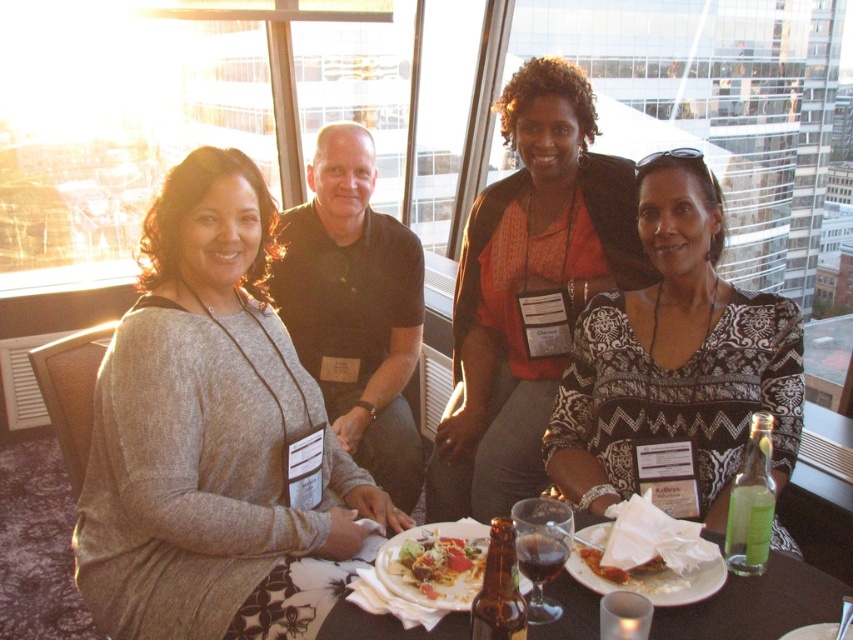
You are a waiter at the high rise restaurant. You need to deliver a drink to the person wearing the matte gray sweater at left. The drink is currently on the table at the center where the crunchy tortilla chips at center are placed. Can you directly hand the drink to the person without moving any items on the table?

The crunchy tortilla chips at center is behind the matte gray sweater at left, so the drink on the table at the center where the crunchy tortilla chips at center are placed is behind the person. Therefore, you cannot directly hand the drink to the person wearing the matte gray sweater at left without moving items on the table.

You are a photographer standing in the same room as the image. You want to take a photo of the black printed blouse at center without moving any objects. Can you capture it clearly from your current position?

The black printed blouse at center is 1.55 meters away from the viewer, so yes, you can capture it clearly from your current position as it is within a reasonable distance for photography.